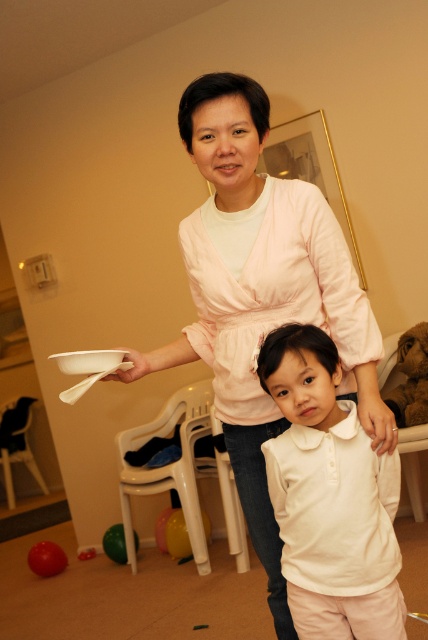
In the scene shown: Who is higher up, matte pink blouse at center or green rubber ball at lower left?

matte pink blouse at center

The image size is (428, 640). I want to click on matte pink blouse at center, so click(261, 296).

Find the location of `matte pink blouse at center`. matte pink blouse at center is located at coordinates (261, 296).

Is white matte plate at upper left shorter than green rubber ball at lower left?

Yes.

Does white matte plate at upper left have a smaller size compared to green rubber ball at lower left?

Yes, white matte plate at upper left is smaller than green rubber ball at lower left.

The width and height of the screenshot is (428, 640). I want to click on white matte plate at upper left, so click(x=92, y=362).

This screenshot has width=428, height=640. What are the coordinates of `white matte plate at upper left` in the screenshot? It's located at (92, 362).

Who is higher up, white matte shirt at center or rubber ball at lower left?

white matte shirt at center is higher up.

Between point (339, 586) and point (41, 552), which one is positioned behind?

The point (41, 552) is behind.

The width and height of the screenshot is (428, 640). I want to click on white matte shirt at center, so click(329, 493).